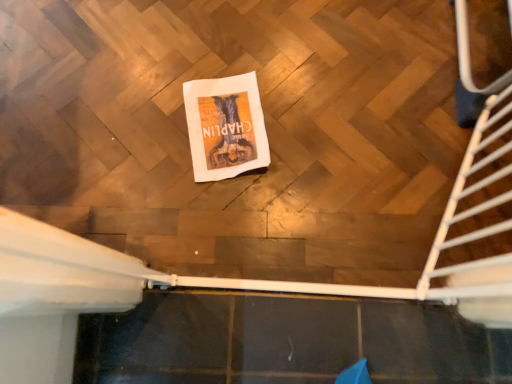
At what (x,y) coordinates should I click in order to perform the action: click on free spot to the right of white paper towel at center. Please return your answer as a coordinate pair (x, y). Looking at the image, I should click on (306, 127).